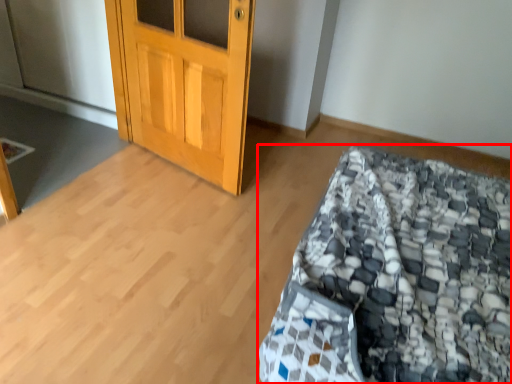
Question: From the image's perspective, where is bed (annotated by the red box) located in relation to door in the image?

Choices:
 (A) below
 (B) above

Answer: (A)